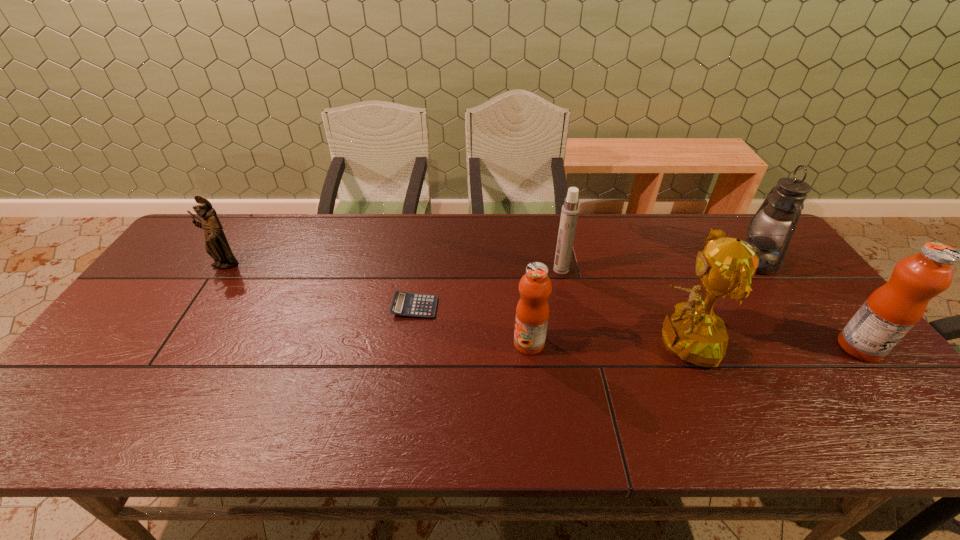
Identify the location of figurine at the far edge. The image size is (960, 540). (216, 245).

I want to click on object that is at the near edge, so click(x=694, y=333).

You are a GUI agent. You are given a task and a screenshot of the screen. Output one action in this format:
    pyautogui.click(x=<x>, y=<y>)
    Task: Click on the object that is at the left edge
    
    Given the screenshot: What is the action you would take?
    pyautogui.click(x=216, y=245)

You are a GUI agent. You are given a task and a screenshot of the screen. Output one action in this format:
    pyautogui.click(x=<x>, y=<y>)
    Task: Click on the fruit juice present at the right edge
    This screenshot has width=960, height=540.
    Given the screenshot: What is the action you would take?
    pyautogui.click(x=890, y=312)

Find the location of a particular element. oil lamp that is at the right edge is located at coordinates (774, 223).

Where is `object located in the far left corner section of the desktop`? The width and height of the screenshot is (960, 540). object located in the far left corner section of the desktop is located at coordinates (216, 245).

What are the coordinates of `object located in the far right corner section of the desktop` in the screenshot? It's located at (774, 223).

Identify the location of vacant space at the far edge of the desktop. (406, 220).

This screenshot has height=540, width=960. Identify the location of vacant space at the near edge. (325, 397).

Where is `vacant space at the right edge`? Image resolution: width=960 pixels, height=540 pixels. vacant space at the right edge is located at coordinates (836, 356).